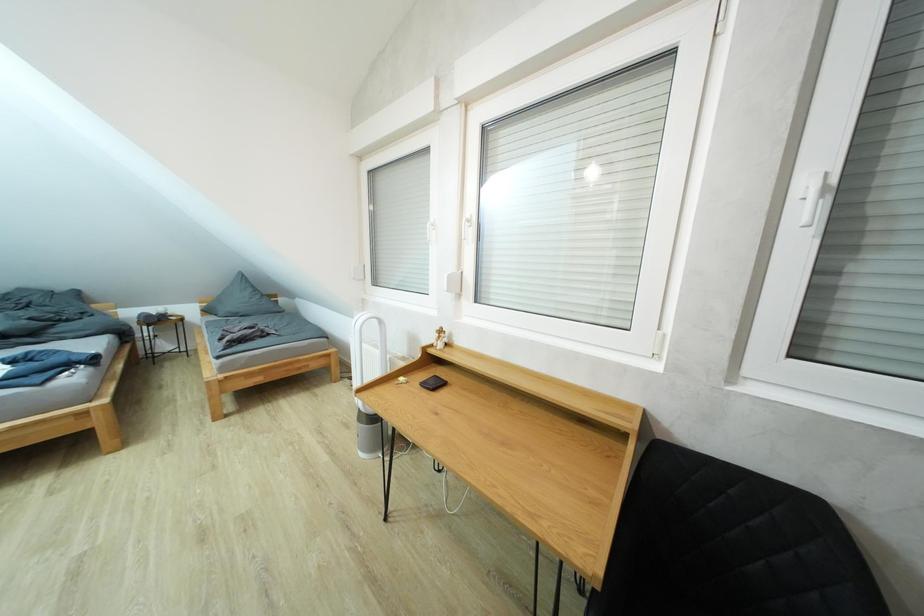
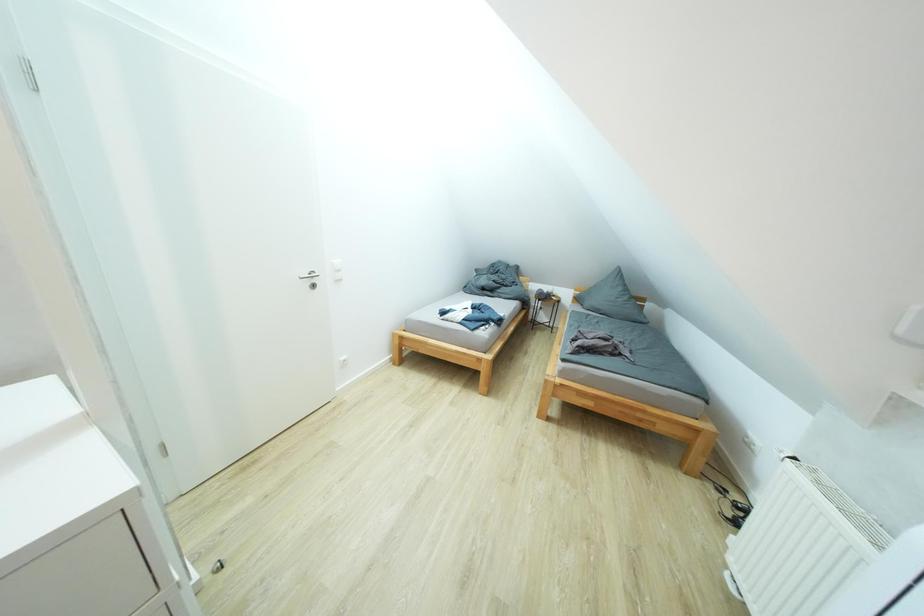
Question: The first image is from the beginning of the video and the second image is from the end. How did the camera likely rotate when shooting the video?

Choices:
 (A) Left
 (B) Right
 (C) Up
 (D) Down

Answer: (A)